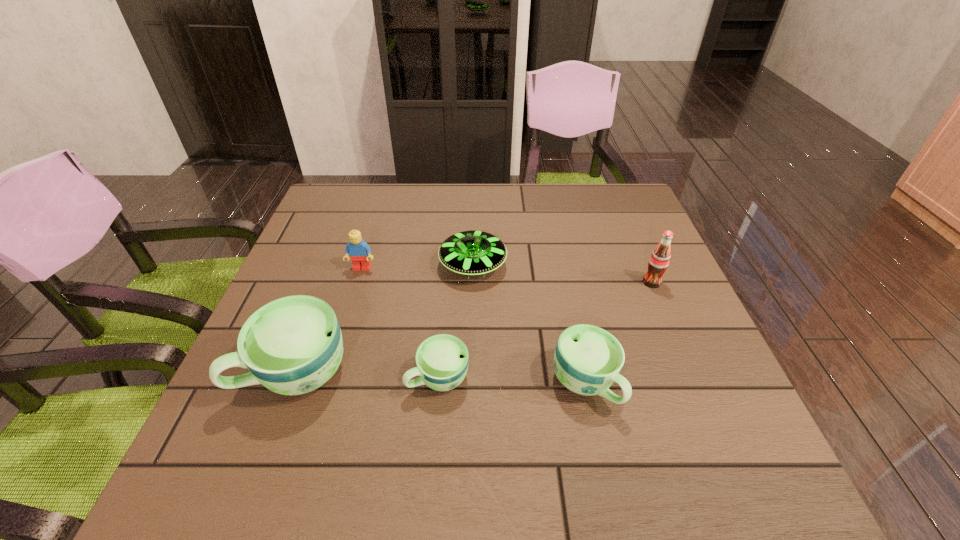
What are the coordinates of `vacant point located between the second tallest cup and the saucer` in the screenshot? It's located at (529, 325).

Find the location of `vacant point located between the fifth object from left to right and the Lego`. vacant point located between the fifth object from left to right and the Lego is located at coordinates (473, 326).

Identify the location of free space that is in between the shortest cup and the fifth object from left to right. (512, 381).

This screenshot has height=540, width=960. What are the coordinates of `vacant region between the Lego and the rightmost object` in the screenshot? It's located at (507, 275).

Identify which object is located as the fourth nearest to the leftmost cup. Please provide its 2D coordinates. Your answer should be formatted as a tuple, i.e. [(x, y)], where the tuple contains the x and y coordinates of a point satisfying the conditions above.

[(587, 360)]

Where is `object that ranks as the fourth closest to the saucer`? The height and width of the screenshot is (540, 960). object that ranks as the fourth closest to the saucer is located at coordinates (293, 345).

The height and width of the screenshot is (540, 960). What are the coordinates of `cup that is the closest to the shortest cup` in the screenshot? It's located at (293, 345).

Where is `the closest cup to the rightmost object`? The image size is (960, 540). the closest cup to the rightmost object is located at coordinates (587, 360).

Identify the location of blank space that satisfies the following two spatial constraints: 1. on the face of the fourth shortest object; 2. on the right side of the fifth object from left to right. This screenshot has width=960, height=540. (326, 384).

Identify the location of vacant region that satisfies the following two spatial constraints: 1. on the face of the second cup from left to right; 2. on the left side of the third tallest object. This screenshot has height=540, width=960. (328, 378).